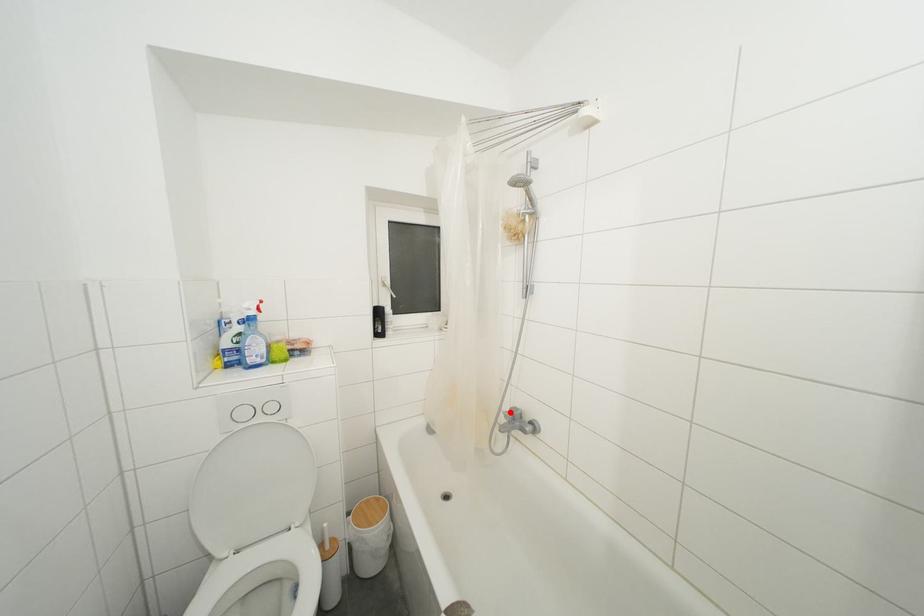
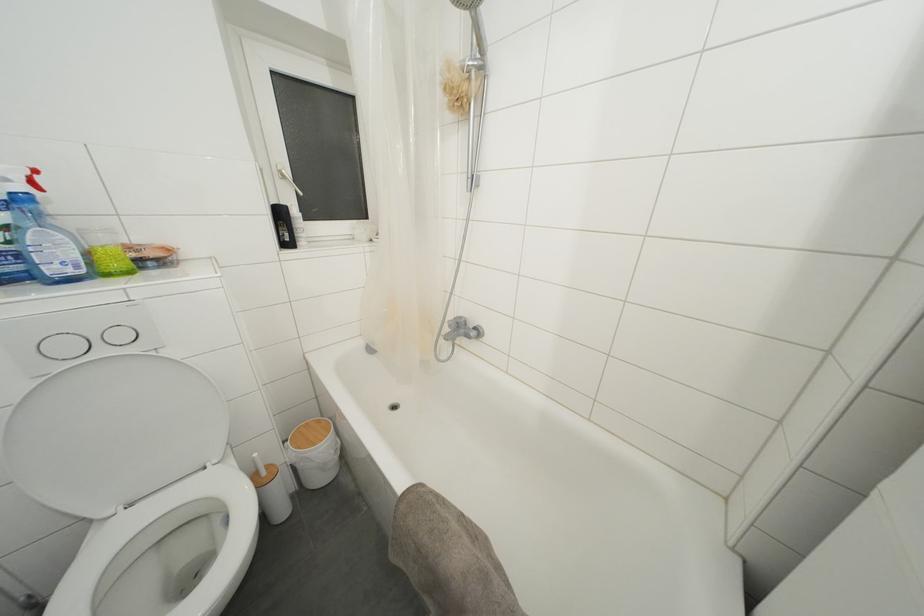
In the second image, find the point that corresponds to the highlighted location in the first image.

(455, 321)